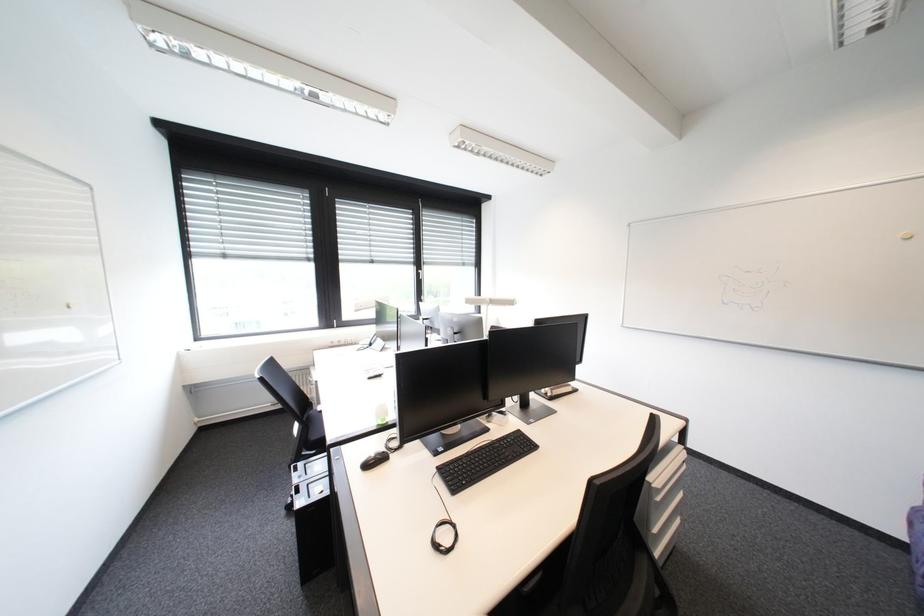
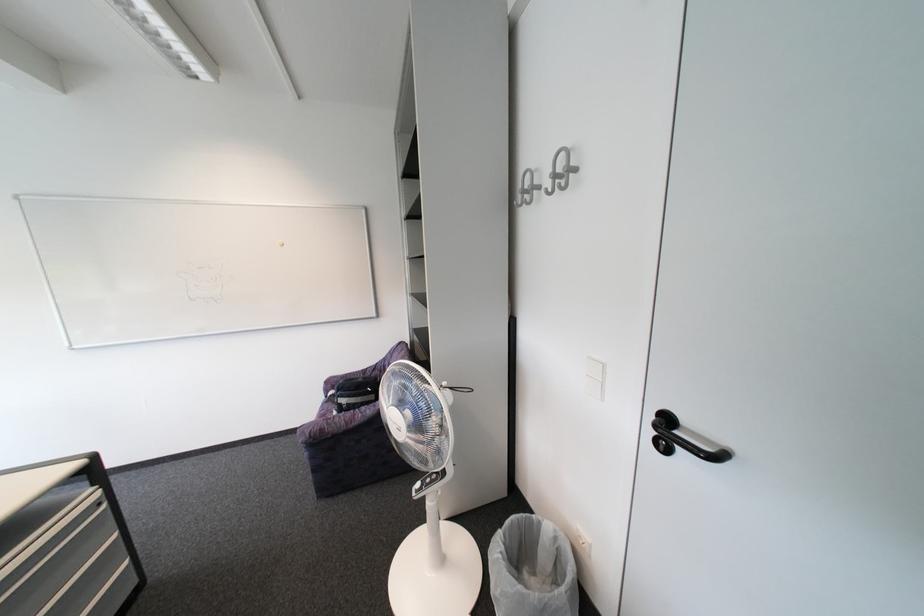
Question: The images are taken continuously from a first-person perspective. In which direction is your viewpoint rotating?

Choices:
 (A) Left
 (B) Right
 (C) Up
 (D) Down

Answer: (B)